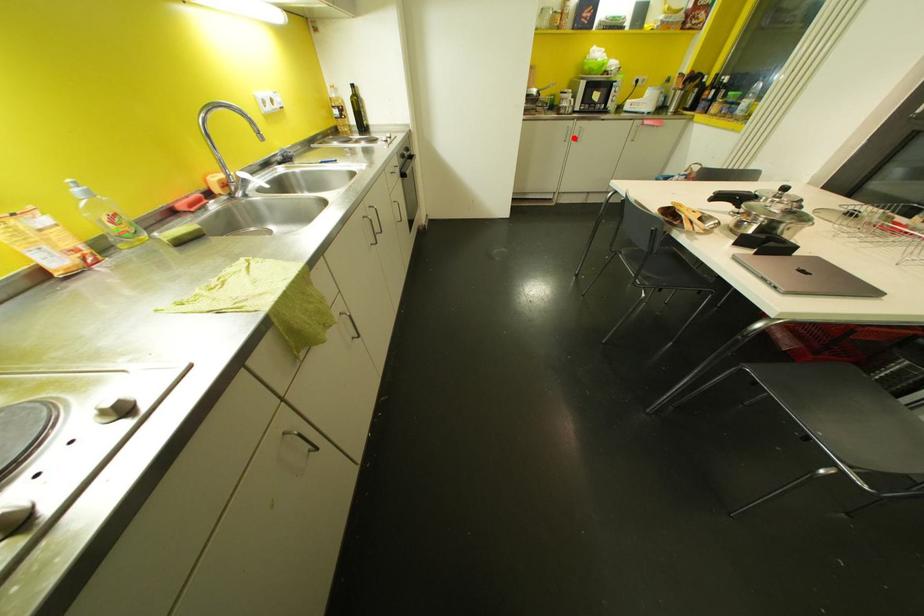
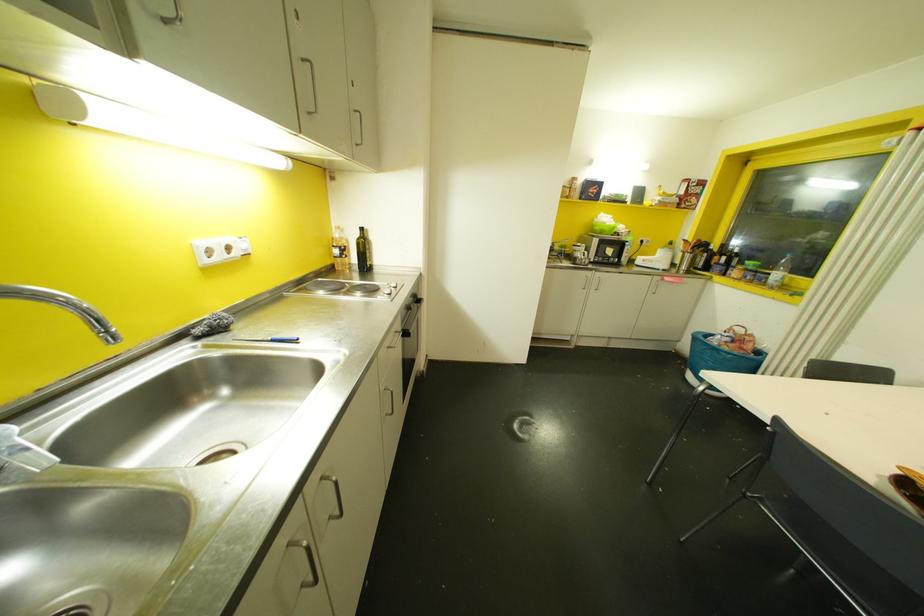
In the second image, find the point that corresponds to the highlighted location in the first image.

(592, 286)